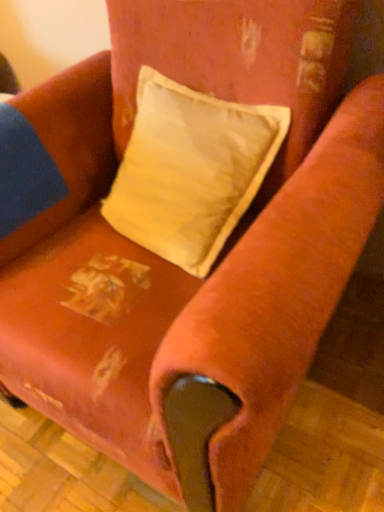
Find the location of a particular element. matte yellow cushion at center is located at coordinates (190, 170).

What do you see at coordinates (190, 170) in the screenshot? I see `matte yellow cushion at center` at bounding box center [190, 170].

What is the approximate width of matte yellow cushion at center?

The width of matte yellow cushion at center is 13.38 inches.

Locate an element on the screen. Image resolution: width=384 pixels, height=512 pixels. matte yellow cushion at center is located at coordinates (190, 170).